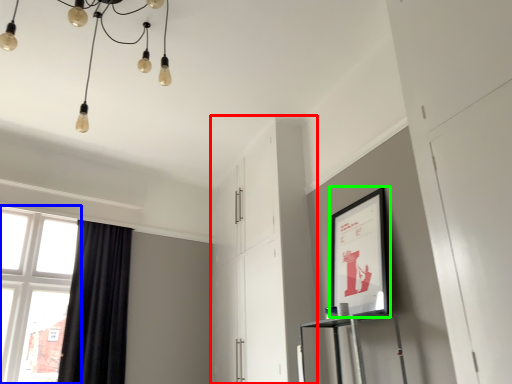
Question: Which object is the closest to the dresser (highlighted by a red box)? Choose among these: window (highlighted by a blue box) or picture frame (highlighted by a green box).

Choices:
 (A) window
 (B) picture frame

Answer: (B)